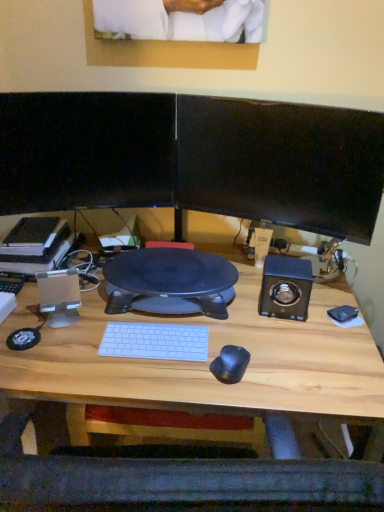
Describe the element at coordinates (86, 151) in the screenshot. I see `black glossy monitor at upper left, positioned as the first computer monitor in left-to-right order` at that location.

How much space does black glossy monitor at upper right, which appears as the 1th computer monitor when viewed from the right, occupy vertically?

black glossy monitor at upper right, which appears as the 1th computer monitor when viewed from the right, is 14.34 inches in height.

Locate an element on the screen. wooden desk at center is located at coordinates (208, 359).

I want to click on computer monitor below the black glossy monitor at upper left, which is the 2th computer monitor from right to left (from the image's perspective), so click(281, 164).

Considering the relative positions of black glossy monitor at upper left, which is the 2th computer monitor from right to left, and black glossy monitor at upper right, which is the second computer monitor from left to right, in the image provided, is black glossy monitor at upper left, which is the 2th computer monitor from right to left, to the right of black glossy monitor at upper right, which is the second computer monitor from left to right, from the viewer's perspective?

Incorrect, black glossy monitor at upper left, which is the 2th computer monitor from right to left, is not on the right side of black glossy monitor at upper right, which is the second computer monitor from left to right.

Is the depth of black glossy monitor at upper left, positioned as the first computer monitor in left-to-right order, less than that of black glossy monitor at upper right, which is the second computer monitor from left to right?

No, black glossy monitor at upper left, positioned as the first computer monitor in left-to-right order, is further to the viewer.

Is black glossy monitor at upper left, which is the 2th computer monitor from right to left, inside or outside of black glossy monitor at upper right, which is the second computer monitor from left to right?

black glossy monitor at upper left, which is the 2th computer monitor from right to left, is outside black glossy monitor at upper right, which is the second computer monitor from left to right.

Is the position of black glossy monitor at upper left, positioned as the first computer monitor in left-to-right order, less distant than that of wooden desk at center?

No, black glossy monitor at upper left, positioned as the first computer monitor in left-to-right order, is behind wooden desk at center.

Can you confirm if black glossy monitor at upper left, which is the 2th computer monitor from right to left, is thinner than wooden desk at center?

Yes.

From the image's perspective, is black glossy monitor at upper left, positioned as the first computer monitor in left-to-right order, on wooden desk at center?

Yes.

Are black glossy monitor at upper left, which is the 2th computer monitor from right to left, and wooden desk at center located far from each other?

They are positioned close to each other.

From a real-world perspective, starting from the wooden desk at center, which computer monitor is the 2nd one vertically above it? Please provide its 2D coordinates.

[(281, 164)]

What's the angular difference between black glossy monitor at upper right, which is the second computer monitor from left to right, and wooden desk at center's facing directions?

157 degrees separate the facing orientations of black glossy monitor at upper right, which is the second computer monitor from left to right, and wooden desk at center.

Considering the sizes of black glossy monitor at upper right, which appears as the 1th computer monitor when viewed from the right, and wooden desk at center in the image, is black glossy monitor at upper right, which appears as the 1th computer monitor when viewed from the right, wider or thinner than wooden desk at center?

black glossy monitor at upper right, which appears as the 1th computer monitor when viewed from the right, is thinner than wooden desk at center.

From the image's perspective, is black glossy monitor at upper right, which is the second computer monitor from left to right, above or below wooden desk at center?

Based on their image positions, black glossy monitor at upper right, which is the second computer monitor from left to right, is located above wooden desk at center.

Which object is positioned more to the left, wooden desk at center or black glossy monitor at upper left, which is the 2th computer monitor from right to left?

Positioned to the left is black glossy monitor at upper left, which is the 2th computer monitor from right to left.

Based on the photo, is wooden desk at center shorter than black glossy monitor at upper left, which is the 2th computer monitor from right to left?

No, wooden desk at center is not shorter than black glossy monitor at upper left, which is the 2th computer monitor from right to left.

Are wooden desk at center and black glossy monitor at upper left, which is the 2th computer monitor from right to left, located far from each other?

They are positioned close to each other.

Which point is more forward, (21, 305) or (58, 123)?

Point (21, 305)

Which object is wider, wooden desk at center or black glossy monitor at upper right, which is the second computer monitor from left to right?

With larger width is wooden desk at center.

Is wooden desk at center beside black glossy monitor at upper right, which appears as the 1th computer monitor when viewed from the right?

wooden desk at center and black glossy monitor at upper right, which appears as the 1th computer monitor when viewed from the right, are clearly separated.

From a real-world perspective, is wooden desk at center above or below black glossy monitor at upper right, which appears as the 1th computer monitor when viewed from the right?

In terms of real-world spatial position, wooden desk at center is below black glossy monitor at upper right, which appears as the 1th computer monitor when viewed from the right.

Is black glossy monitor at upper right, which is the second computer monitor from left to right, at the back of wooden desk at center?

No, wooden desk at center is not facing away from black glossy monitor at upper right, which is the second computer monitor from left to right.

Is black glossy monitor at upper right, which is the second computer monitor from left to right, oriented away from black glossy monitor at upper left, positioned as the first computer monitor in left-to-right order?

Answer: No, black glossy monitor at upper left, positioned as the first computer monitor in left-to-right order, is not at the back of black glossy monitor at upper right, which is the second computer monitor from left to right.

Can you confirm if black glossy monitor at upper right, which appears as the 1th computer monitor when viewed from the right, is positioned to the right of black glossy monitor at upper left, which is the 2th computer monitor from right to left?

Yes.

Is point (186, 172) behind point (128, 150)?

Yes, it is.

How many degrees apart are the facing directions of black glossy monitor at upper right, which appears as the 1th computer monitor when viewed from the right, and black glossy monitor at upper left, which is the 2th computer monitor from right to left?

black glossy monitor at upper right, which appears as the 1th computer monitor when viewed from the right, and black glossy monitor at upper left, which is the 2th computer monitor from right to left, are facing 39.8 degrees away from each other.

The width and height of the screenshot is (384, 512). I want to click on computer monitor on the left side of black glossy monitor at upper right, which appears as the 1th computer monitor when viewed from the right, so click(x=86, y=151).

The height and width of the screenshot is (512, 384). In order to click on the 2nd computer monitor behind the wooden desk at center in this screenshot , I will do `click(86, 151)`.

Estimate the real-world distances between objects in this image. Which object is further from black glossy monitor at upper right, which appears as the 1th computer monitor when viewed from the right, black glossy monitor at upper left, positioned as the first computer monitor in left-to-right order, or wooden desk at center?

wooden desk at center is positioned further to the anchor black glossy monitor at upper right, which appears as the 1th computer monitor when viewed from the right.

From the image, which object appears to be farther from black glossy monitor at upper left, which is the 2th computer monitor from right to left, black glossy monitor at upper right, which appears as the 1th computer monitor when viewed from the right, or wooden desk at center?

Among the two, wooden desk at center is located further to black glossy monitor at upper left, which is the 2th computer monitor from right to left.

Considering their positions, is black glossy monitor at upper left, positioned as the first computer monitor in left-to-right order, positioned closer to wooden desk at center than black glossy monitor at upper right, which is the second computer monitor from left to right?

Among the two, black glossy monitor at upper right, which is the second computer monitor from left to right, is located nearer to wooden desk at center.

Looking at the image, which one is located closer to wooden desk at center, black glossy monitor at upper right, which is the second computer monitor from left to right, or black glossy monitor at upper left, which is the 2th computer monitor from right to left?

black glossy monitor at upper right, which is the second computer monitor from left to right.

Estimate the real-world distances between objects in this image. Which object is further from black glossy monitor at upper left, positioned as the first computer monitor in left-to-right order, wooden desk at center or black glossy monitor at upper right, which appears as the 1th computer monitor when viewed from the right?

The object further to black glossy monitor at upper left, positioned as the first computer monitor in left-to-right order, is wooden desk at center.

Based on their spatial positions, is wooden desk at center or black glossy monitor at upper left, which is the 2th computer monitor from right to left, further from black glossy monitor at upper right, which is the second computer monitor from left to right?

wooden desk at center.

Where is `computer monitor between wooden desk at center and black glossy monitor at upper left, which is the 2th computer monitor from right to left, in the front-back direction`? This screenshot has height=512, width=384. computer monitor between wooden desk at center and black glossy monitor at upper left, which is the 2th computer monitor from right to left, in the front-back direction is located at coordinates (281, 164).